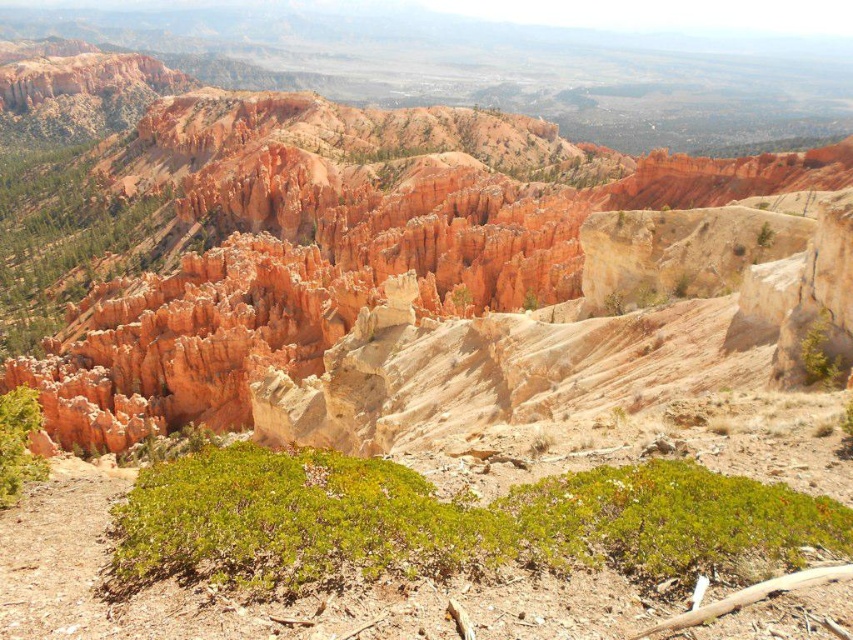
Question: Can you confirm if green shrubbery at center is positioned below green shrubbery at left?

Choices:
 (A) yes
 (B) no

Answer: (A)

Question: Can you confirm if green shrubbery at center is thinner than green shrubbery at left?

Choices:
 (A) yes
 (B) no

Answer: (A)

Question: Estimate the real-world distances between objects in this image. Which object is farther from the green shrubbery at left?

Choices:
 (A) green shrubbery at center
 (B) green leafy bush at lower left

Answer: (B)

Question: Which of the following is the farthest from the observer?

Choices:
 (A) green shrubbery at center
 (B) green shrubbery at left

Answer: (B)

Question: In this image, where is green shrubbery at center located relative to green leafy bush at lower left?

Choices:
 (A) below
 (B) above

Answer: (A)

Question: Which object is positioned closest to the green leafy bush at lower left?

Choices:
 (A) green shrubbery at center
 (B) green shrubbery at left

Answer: (A)